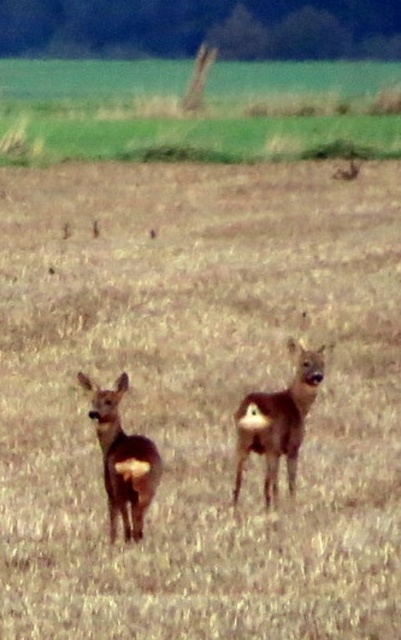
Which is more to the right, brown matte deer at center or brown matte roe deer at center?

brown matte deer at center

Does point (275, 396) lie behind point (129, 486)?

Yes, point (275, 396) is behind point (129, 486).

You are a GUI agent. You are given a task and a screenshot of the screen. Output one action in this format:
    pyautogui.click(x=<x>, y=<y>)
    Task: Click on the brown matte deer at center
    This screenshot has width=401, height=640.
    Given the screenshot: What is the action you would take?
    pyautogui.click(x=277, y=420)